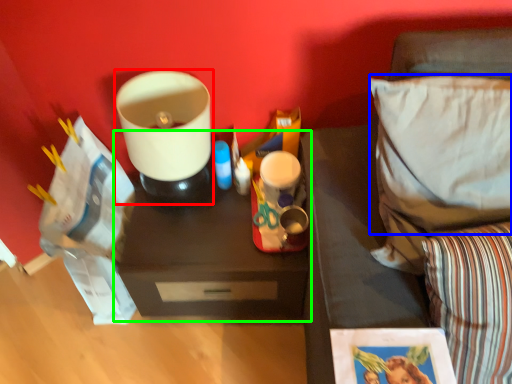
Question: Which object is the closest to the appliance (highlighted by a red box)? Choose among these: pillow (highlighted by a blue box) or table (highlighted by a green box).

Choices:
 (A) pillow
 (B) table

Answer: (B)